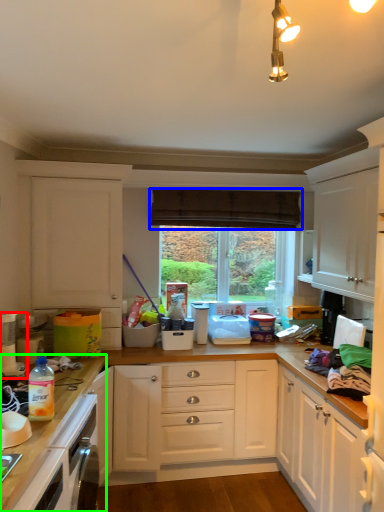
Question: Which object is the closest to the kitchen appliance (highlighted by a red box)? Choose among these: curtain (highlighted by a blue box) or countertop (highlighted by a green box).

Choices:
 (A) curtain
 (B) countertop

Answer: (B)